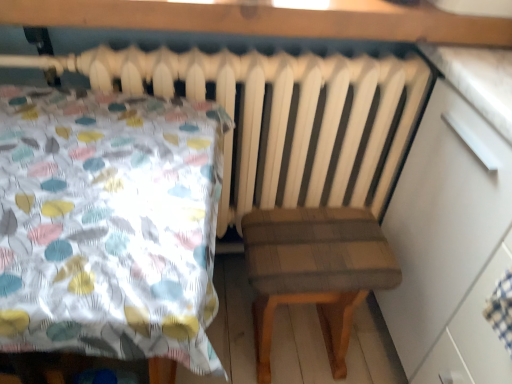
Question: From the image's perspective, is plaid fabric stool at center positioned above or below white glossy dresser at right?

Choices:
 (A) below
 (B) above

Answer: (A)

Question: Visually, is plaid fabric stool at center positioned to the left or to the right of white glossy dresser at right?

Choices:
 (A) left
 (B) right

Answer: (A)

Question: From a real-world perspective, relative to white glossy dresser at right, is plaid fabric stool at center vertically above or below?

Choices:
 (A) below
 (B) above

Answer: (A)

Question: Is white glossy dresser at right in front of or behind plaid fabric stool at center in the image?

Choices:
 (A) behind
 (B) front

Answer: (B)

Question: From a real-world perspective, is white glossy dresser at right positioned above or below plaid fabric stool at center?

Choices:
 (A) below
 (B) above

Answer: (B)

Question: Is white glossy dresser at right inside the boundaries of plaid fabric stool at center, or outside?

Choices:
 (A) inside
 (B) outside

Answer: (B)

Question: Is white glossy dresser at right wider or thinner than plaid fabric stool at center?

Choices:
 (A) thin
 (B) wide

Answer: (B)